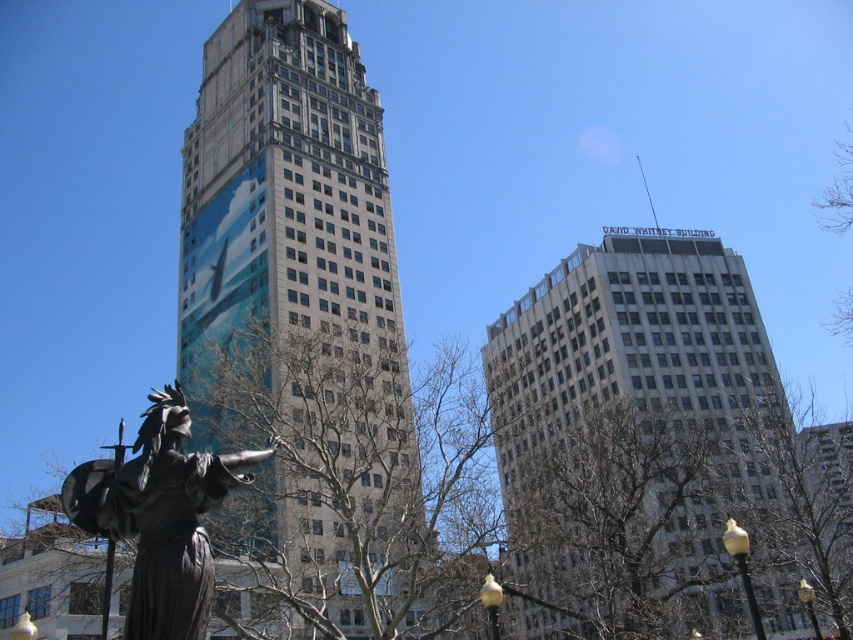
Who is shorter, metallic glass skyscraper at center or white glass building at upper right?

white glass building at upper right is shorter.

Can you confirm if metallic glass skyscraper at center is bigger than white glass building at upper right?

No.

Identify the location of metallic glass skyscraper at center. (300, 321).

Does white glass building at upper right lie behind bronze statue at lower left?

Yes, it is behind bronze statue at lower left.

In the scene shown: How distant is white glass building at upper right from bronze statue at lower left?

white glass building at upper right and bronze statue at lower left are 37.40 meters apart from each other.

Locate an element on the screen. white glass building at upper right is located at coordinates (637, 438).

Is metallic glass skyscraper at center wider than bronze statue at lower left?

Yes.

Is metallic glass skyscraper at center shorter than bronze statue at lower left?

No.

Does point (271, 401) lie behind point (151, 440)?

Yes, point (271, 401) is farther from viewer.

Where is `metallic glass skyscraper at center`? Image resolution: width=853 pixels, height=640 pixels. metallic glass skyscraper at center is located at coordinates (300, 321).